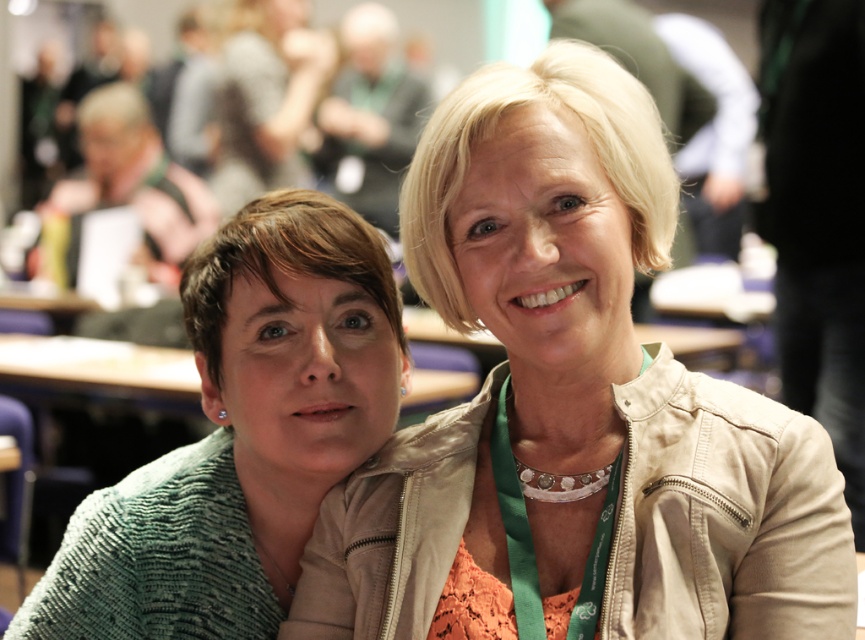
Question: Can you confirm if beige leather jacket at upper center is positioned to the right of green knitted sweater at left?

Choices:
 (A) no
 (B) yes

Answer: (B)

Question: Among these points, which one is nearest to the camera?

Choices:
 (A) (252, 493)
 (B) (696, 584)

Answer: (B)

Question: Which point is farther from the camera taking this photo?

Choices:
 (A) (761, 417)
 (B) (375, 237)

Answer: (B)

Question: Does beige leather jacket at upper center have a larger size compared to green knitted sweater at left?

Choices:
 (A) no
 (B) yes

Answer: (B)

Question: Does beige leather jacket at upper center have a larger size compared to green knitted sweater at left?

Choices:
 (A) no
 (B) yes

Answer: (B)